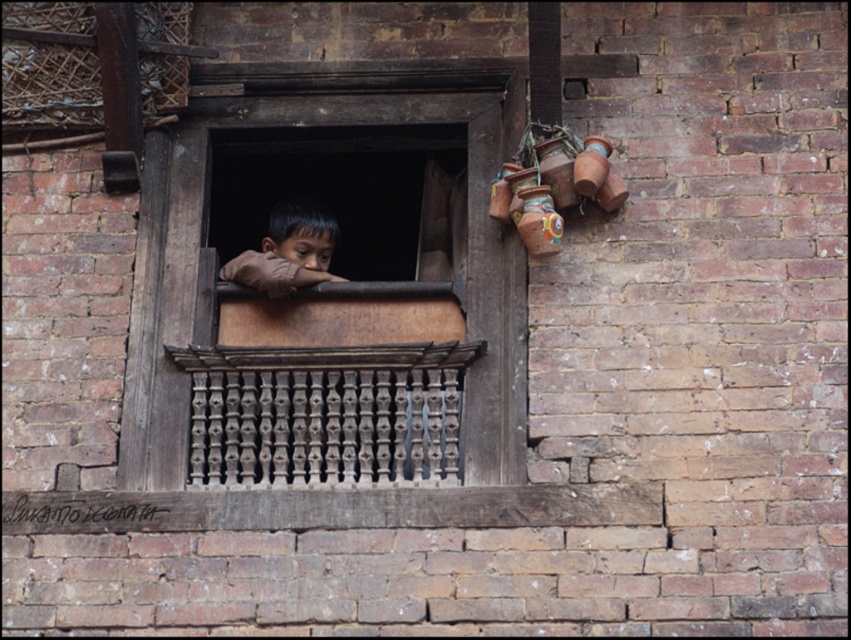
You are a painter standing on the ground in front of the building. You want to paint the dark brown wood at center and the brown leather child at center. Which object should you look upwards to paint?

You should look upwards to paint the brown leather child at center because the dark brown wood at center is below it.

You are a painter standing on a ladder 10 feet away from the dark brown wood at center. You want to paint the brown leather child at center. Can you reach the child with your 3.5 feet long paintbrush?

The dark brown wood at center is 13.21 feet from the brown leather child at center. Since you are 10 feet away from the dark brown wood at center, your total distance to the child is 10 feet plus 13.21 feet equals 23.21 feet. Your paintbrush is only 3.5 feet long, so you cannot reach the child.

Consider the image. You are a painter standing on a ladder in front of the rustic brick building. You need to paint the dark brown wood at center and the brown leather child at center. Which object should you paint first if you want to start with the one that is higher up?

The dark brown wood at center is taller than the brown leather child at center, so you should paint the dark brown wood at center first since it is higher up.